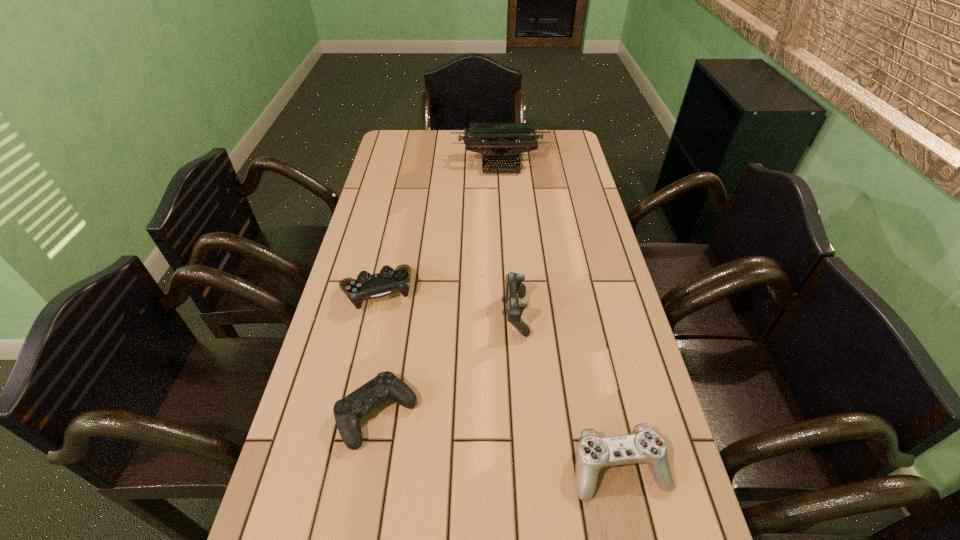
Locate an element on the screen. typewriter is located at coordinates (500, 142).

This screenshot has height=540, width=960. Identify the location of the farthest object. (500, 142).

The height and width of the screenshot is (540, 960). Find the location of `the fourth shortest object`. the fourth shortest object is located at coordinates (514, 288).

This screenshot has height=540, width=960. What are the coordinates of `the second control from right to left` in the screenshot? It's located at (514, 288).

The width and height of the screenshot is (960, 540). I want to click on the third shortest control, so click(x=366, y=286).

Locate an element on the screen. Image resolution: width=960 pixels, height=540 pixels. the rightmost control is located at coordinates coord(645,445).

Identify the location of free spot located 0.340m on the typing side of the typewriter. (505, 238).

You are a GUI agent. You are given a task and a screenshot of the screen. Output one action in this format:
    pyautogui.click(x=<x>, y=<y>)
    Task: Click on the free location located on the surface of the second tallest object with buttons
    
    Given the screenshot: What is the action you would take?
    pyautogui.click(x=413, y=314)

Identify the location of vacant space located on the surface of the second tallest object with buttons. (441, 314).

This screenshot has width=960, height=540. I want to click on vacant space situated 0.250m on the surface of the second tallest object with buttons, so click(401, 314).